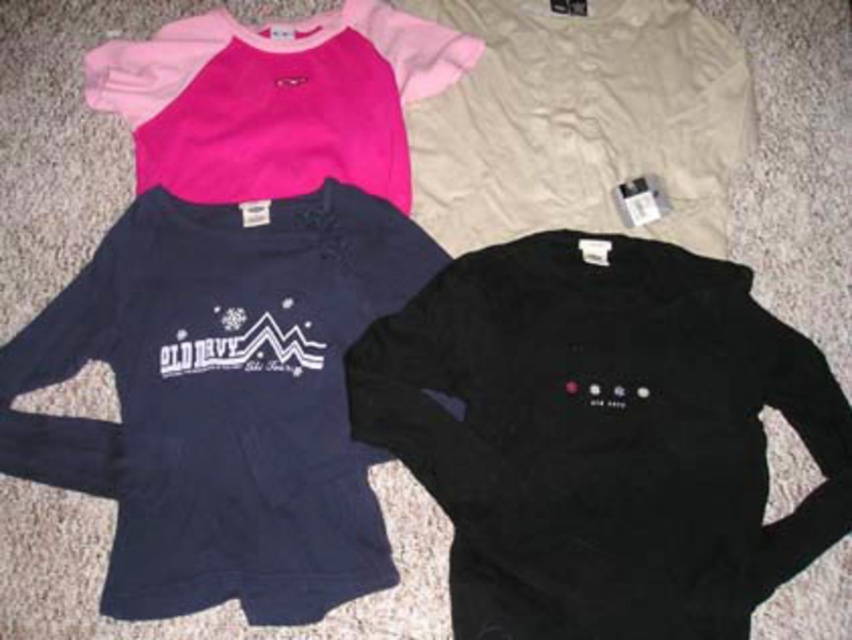
Which is more to the left, black fleece sweatshirt at lower right or beige cotton sweatshirt at upper center?

black fleece sweatshirt at lower right

Is black fleece sweatshirt at lower right shorter than beige cotton sweatshirt at upper center?

No.

Is point (740, 628) less distant than point (709, 115)?

Yes, point (740, 628) is in front of point (709, 115).

The image size is (852, 640). In order to click on black fleece sweatshirt at lower right in this screenshot , I will do `click(603, 436)`.

Which is in front, point (461, 545) or point (21, 426)?

Point (461, 545)

Is black fleece sweatshirt at lower right shorter than navy fleece sweatshirt at upper left?

Yes.

Is point (516, 528) more distant than point (334, 406)?

No, (516, 528) is closer to viewer.

Identify the location of black fleece sweatshirt at lower right. click(603, 436).

Locate an element on the screen. This screenshot has width=852, height=640. beige cotton sweatshirt at upper center is located at coordinates (579, 120).

Between point (608, 163) and point (285, 150), which one is positioned in front?

Point (608, 163) is more forward.

Is point (722, 100) positioned in front of point (321, 16)?

Yes, point (722, 100) is in front of point (321, 16).

At what (x,y) coordinates should I click in order to perform the action: click on beige cotton sweatshirt at upper center. Please return your answer as a coordinate pair (x, y). This screenshot has width=852, height=640. Looking at the image, I should click on (579, 120).